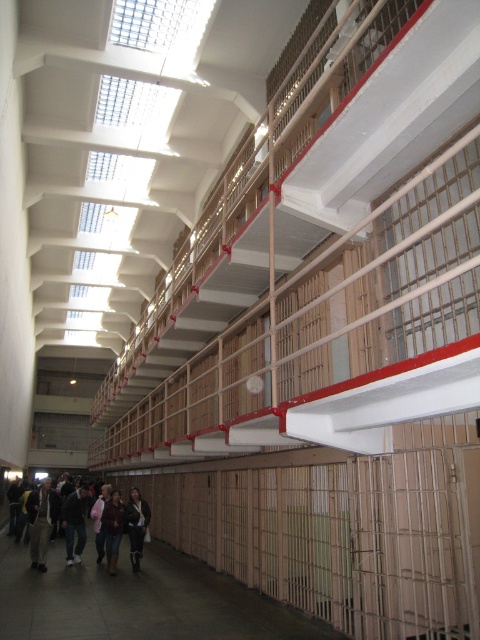
Which is more to the right, dark brown leather jacket at lower left or dark gray pants at lower left?

Positioned to the right is dark brown leather jacket at lower left.

Does dark brown leather jacket at lower left have a larger size compared to dark gray pants at lower left?

No, dark brown leather jacket at lower left is not bigger than dark gray pants at lower left.

Is point (36, 506) closer to viewer compared to point (38, 544)?

No, it is behind (38, 544).

Locate an element on the screen. dark brown leather jacket at lower left is located at coordinates (72, 520).

Measure the distance from dark gray jacket at lower left to dark brown leather jacket at center.

5.36 feet

Is dark gray jacket at lower left wider than dark brown leather jacket at center?

Yes.

Is point (79, 561) positioned after point (132, 557)?

Yes, point (79, 561) is farther from viewer.

Identify the location of dark gray jacket at lower left. This screenshot has height=640, width=480. (74, 524).

Between dark brown leather jacket at center and pink fabric jacket at lower center, which one appears on the right side from the viewer's perspective?

Positioned to the right is dark brown leather jacket at center.

Is point (143, 532) positioned behind point (113, 566)?

Yes, it is behind point (113, 566).

This screenshot has width=480, height=640. Find the location of `dark brown leather jacket at center`. dark brown leather jacket at center is located at coordinates (135, 525).